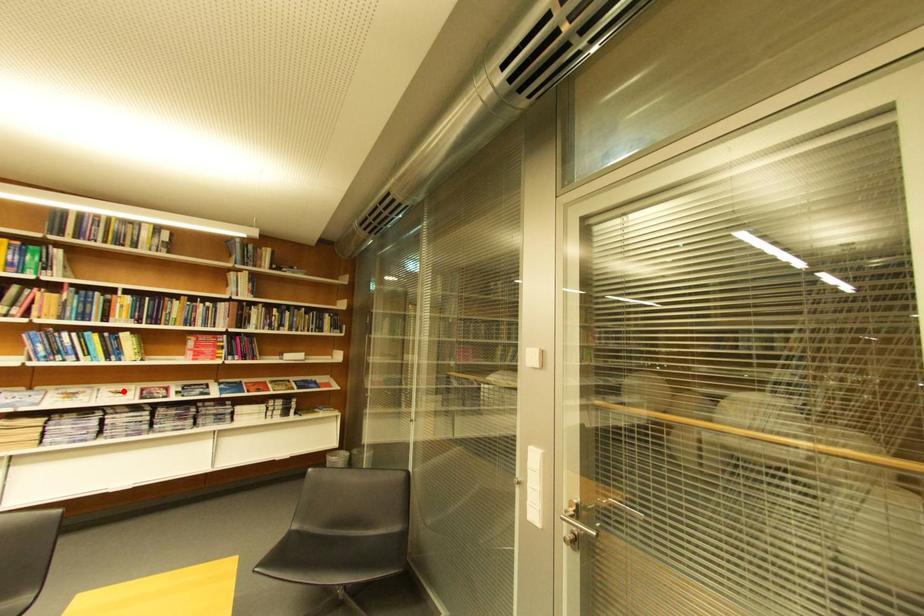
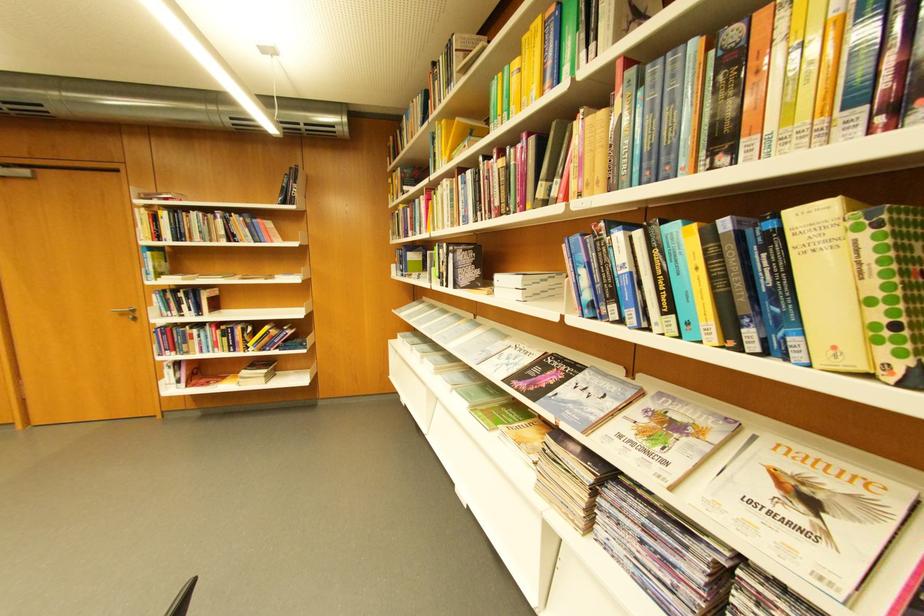
Find the pixel in the second image that matches the highlighted location in the first image.

(800, 469)